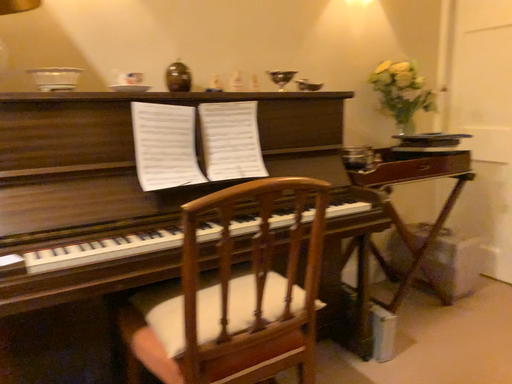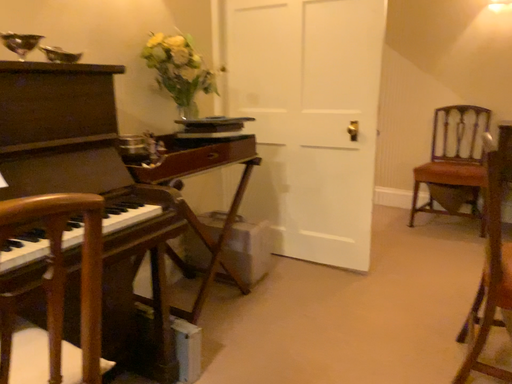
Question: How did the camera likely rotate when shooting the video?

Choices:
 (A) rotated right
 (B) rotated left

Answer: (A)